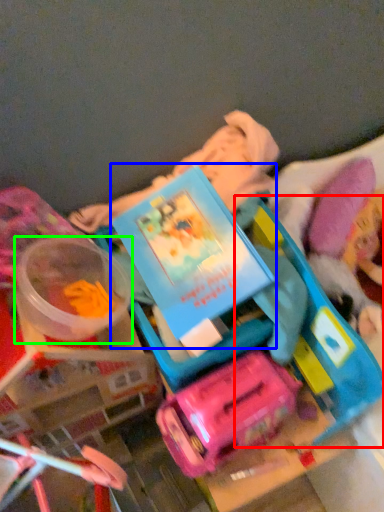
Question: Which object is positioned closest to toy (highlighted by a red box)? Select from book (highlighted by a blue box) and toy (highlighted by a green box).

Choices:
 (A) book
 (B) toy

Answer: (A)